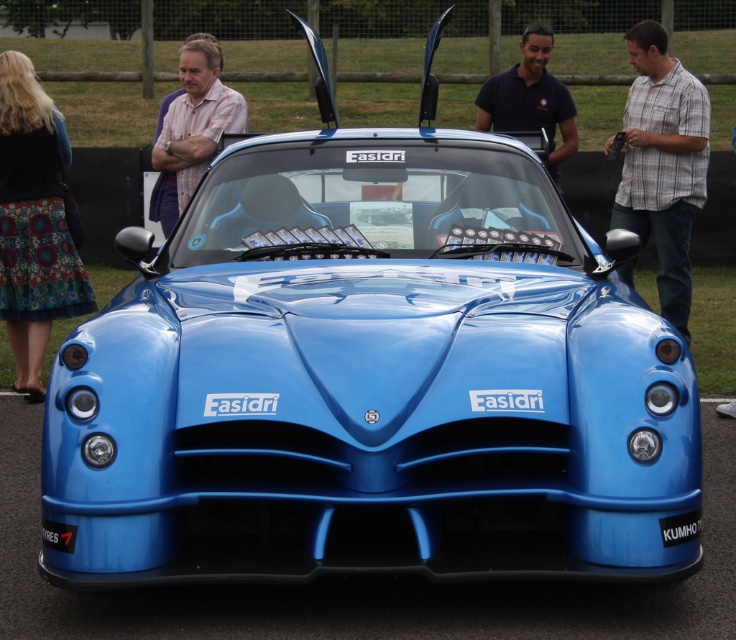
Does plaid shirt at center have a greater height compared to black shirt at center?

Yes, plaid shirt at center is taller than black shirt at center.

Between point (657, 273) and point (542, 42), which one is positioned behind?

Point (657, 273)

The width and height of the screenshot is (736, 640). Identify the location of plaid shirt at center. (662, 163).

Who is higher up, floral skirt at lower left or matte black car at center?

matte black car at center is higher up.

Measure the distance between point (14, 326) and camera.

Point (14, 326) and camera are 9.40 meters apart.

At what (x,y) coordinates should I click in order to perform the action: click on floral skirt at lower left. Please return your answer as a coordinate pair (x, y). This screenshot has width=736, height=640. Looking at the image, I should click on (32, 221).

The width and height of the screenshot is (736, 640). I want to click on floral skirt at lower left, so click(32, 221).

Is plaid shirt at center thinner than matte black car at center?

Indeed, plaid shirt at center has a lesser width compared to matte black car at center.

Is plaid shirt at center smaller than matte black car at center?

Indeed, plaid shirt at center has a smaller size compared to matte black car at center.

You are a GUI agent. You are given a task and a screenshot of the screen. Output one action in this format:
    pyautogui.click(x=<x>, y=<y>)
    Task: Click on the plaid shirt at center
    The width and height of the screenshot is (736, 640).
    Given the screenshot: What is the action you would take?
    pyautogui.click(x=662, y=163)

Identify the location of plaid shirt at center. The height and width of the screenshot is (640, 736). (662, 163).